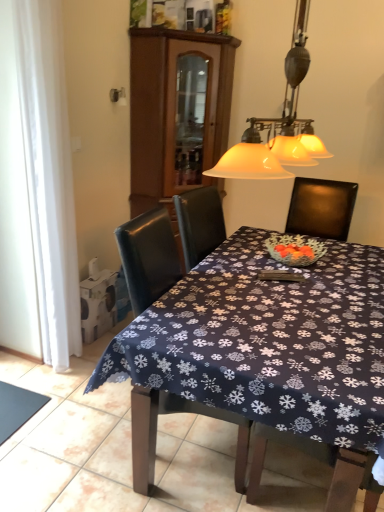
Question: Is white sheer curtain at left located outside dark blue fabric at lower left?

Choices:
 (A) no
 (B) yes

Answer: (B)

Question: From a real-world perspective, is white sheer curtain at left positioned under dark blue fabric at lower left based on gravity?

Choices:
 (A) no
 (B) yes

Answer: (A)

Question: Considering the relative positions of white sheer curtain at left and dark blue fabric at lower left in the image provided, is white sheer curtain at left to the left of dark blue fabric at lower left from the viewer's perspective?

Choices:
 (A) yes
 (B) no

Answer: (B)

Question: Would you consider white sheer curtain at left to be distant from dark blue fabric at lower left?

Choices:
 (A) no
 (B) yes

Answer: (A)

Question: From the image's perspective, is white sheer curtain at left on dark blue fabric at lower left?

Choices:
 (A) no
 (B) yes

Answer: (B)

Question: Does white sheer curtain at left have a greater height compared to dark blue fabric at lower left?

Choices:
 (A) no
 (B) yes

Answer: (B)

Question: Does brown wood cabinet at upper center have a lesser height compared to leather chair at center?

Choices:
 (A) no
 (B) yes

Answer: (A)

Question: Can you confirm if brown wood cabinet at upper center is smaller than leather chair at center?

Choices:
 (A) no
 (B) yes

Answer: (A)

Question: Is brown wood cabinet at upper center positioned behind leather chair at center?

Choices:
 (A) yes
 (B) no

Answer: (A)

Question: From a real-world perspective, is brown wood cabinet at upper center below leather chair at center?

Choices:
 (A) yes
 (B) no

Answer: (B)

Question: Is leather chair at center at the back of brown wood cabinet at upper center?

Choices:
 (A) yes
 (B) no

Answer: (B)

Question: Is brown wood cabinet at upper center taller than leather chair at center?

Choices:
 (A) no
 (B) yes

Answer: (B)

Question: Is brown wood cabinet at upper center taller than dark blue fabric at lower left?

Choices:
 (A) yes
 (B) no

Answer: (A)